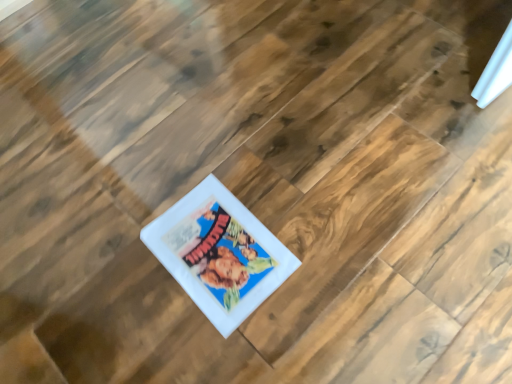
The image size is (512, 384). Identify the location of free spot above white plastic picture frame at center (from a real-world perspective). (213, 241).